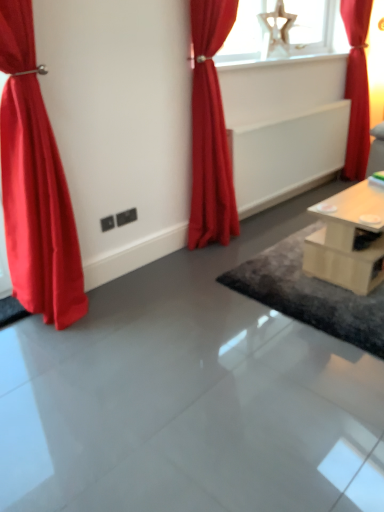
Question: Considering the relative sizes of light wood table at right and dark gray textured rug at center in the image provided, is light wood table at right taller than dark gray textured rug at center?

Choices:
 (A) no
 (B) yes

Answer: (B)

Question: From the image's perspective, would you say light wood table at right is shown under dark gray textured rug at center?

Choices:
 (A) yes
 (B) no

Answer: (B)

Question: Is light wood table at right to the left of dark gray textured rug at center from the viewer's perspective?

Choices:
 (A) no
 (B) yes

Answer: (A)

Question: From the image's perspective, is light wood table at right located above dark gray textured rug at center?

Choices:
 (A) yes
 (B) no

Answer: (A)

Question: Is light wood table at right surrounding dark gray textured rug at center?

Choices:
 (A) no
 (B) yes

Answer: (A)

Question: Based on their positions, is white glossy radiator at upper center located to the left or right of dark gray textured rug at center?

Choices:
 (A) left
 (B) right

Answer: (A)

Question: Looking at the image, does white glossy radiator at upper center seem bigger or smaller compared to dark gray textured rug at center?

Choices:
 (A) big
 (B) small

Answer: (B)

Question: Does point (296, 55) appear closer or farther from the camera than point (279, 275)?

Choices:
 (A) farther
 (B) closer

Answer: (A)

Question: Relative to dark gray textured rug at center, is white glossy radiator at upper center in front or behind?

Choices:
 (A) behind
 (B) front

Answer: (A)

Question: Considering the positions of matte red curtain at center, positioned as the second curtain in left-to-right order, and white glossy radiator at upper center in the image, is matte red curtain at center, positioned as the second curtain in left-to-right order, bigger or smaller than white glossy radiator at upper center?

Choices:
 (A) big
 (B) small

Answer: (A)

Question: In terms of width, does matte red curtain at center, positioned as the second curtain in left-to-right order, look wider or thinner when compared to white glossy radiator at upper center?

Choices:
 (A) thin
 (B) wide

Answer: (A)

Question: From the image's perspective, is matte red curtain at center, acting as the second curtain starting from the front, located above or below white glossy radiator at upper center?

Choices:
 (A) below
 (B) above

Answer: (A)

Question: From a real-world perspective, is matte red curtain at center, positioned as the second curtain in left-to-right order, physically located above or below white glossy radiator at upper center?

Choices:
 (A) below
 (B) above

Answer: (A)

Question: Is light wood table at right situated inside matte red curtain at left, which ranks as the third curtain in right-to-left order, or outside?

Choices:
 (A) inside
 (B) outside

Answer: (B)

Question: Considering their positions, is light wood table at right located in front of or behind matte red curtain at left, acting as the 3th curtain starting from the back?

Choices:
 (A) front
 (B) behind

Answer: (B)